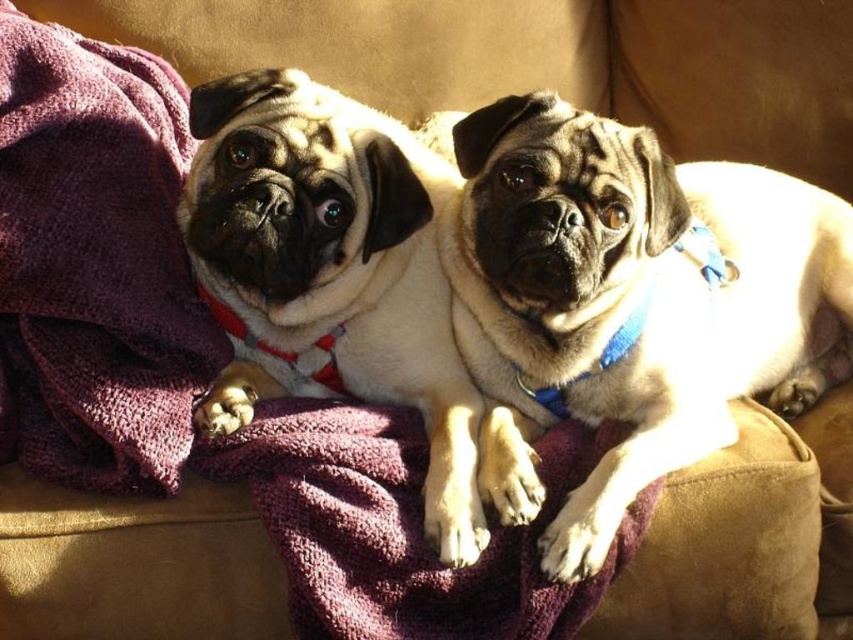
Is point (555, 365) closer to camera compared to point (260, 104)?

No, (555, 365) is further to viewer.

Which of these two, matte beige pug at center or smooth beige dog at center, stands taller?

Standing taller between the two is smooth beige dog at center.

Between point (569, 372) and point (351, 260), which one is positioned behind?

Point (569, 372)

You are a GUI agent. You are given a task and a screenshot of the screen. Output one action in this format:
    pyautogui.click(x=<x>, y=<y>)
    Task: Click on the matte beige pug at center
    The width and height of the screenshot is (853, 640).
    Given the screenshot: What is the action you would take?
    click(x=630, y=301)

Which is more to the left, smooth beige dog at center or purple soft towel at left?

From the viewer's perspective, purple soft towel at left appears more on the left side.

Is smooth beige dog at center thinner than purple soft towel at left?

No, smooth beige dog at center is not thinner than purple soft towel at left.

Does point (360, 349) come closer to viewer compared to point (80, 168)?

That is False.

Find the location of a particular element. The height and width of the screenshot is (640, 853). smooth beige dog at center is located at coordinates (338, 280).

Does matte beige pug at center appear on the right side of purple soft towel at left?

Indeed, matte beige pug at center is positioned on the right side of purple soft towel at left.

Can you confirm if matte beige pug at center is positioned to the left of purple soft towel at left?

In fact, matte beige pug at center is to the right of purple soft towel at left.

Locate an element on the screen. Image resolution: width=853 pixels, height=640 pixels. matte beige pug at center is located at coordinates (630, 301).